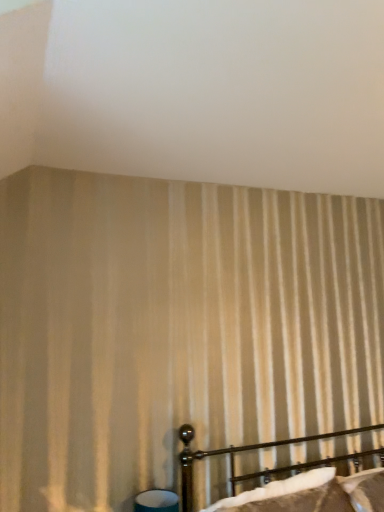
Question: Should I look upward or downward to see polished dark brown bed at lower right?

Choices:
 (A) down
 (B) up

Answer: (A)

Question: From the image's perspective, is teal fabric table lamp at lower center on polished dark brown bed at lower right?

Choices:
 (A) no
 (B) yes

Answer: (A)

Question: Is teal fabric table lamp at lower center located outside polished dark brown bed at lower right?

Choices:
 (A) yes
 (B) no

Answer: (A)

Question: Is teal fabric table lamp at lower center directly adjacent to polished dark brown bed at lower right?

Choices:
 (A) yes
 (B) no

Answer: (B)

Question: Is teal fabric table lamp at lower center bigger than polished dark brown bed at lower right?

Choices:
 (A) no
 (B) yes

Answer: (A)

Question: Is the depth of teal fabric table lamp at lower center greater than that of polished dark brown bed at lower right?

Choices:
 (A) yes
 (B) no

Answer: (A)

Question: From the image's perspective, is teal fabric table lamp at lower center located beneath polished dark brown bed at lower right?

Choices:
 (A) no
 (B) yes

Answer: (B)

Question: Would you say teal fabric table lamp at lower center is part of polished dark brown bed at lower right's contents?

Choices:
 (A) no
 (B) yes

Answer: (A)

Question: From a real-world perspective, is polished dark brown bed at lower right over teal fabric table lamp at lower center?

Choices:
 (A) yes
 (B) no

Answer: (A)

Question: Is polished dark brown bed at lower right turned away from teal fabric table lamp at lower center?

Choices:
 (A) yes
 (B) no

Answer: (B)

Question: Is polished dark brown bed at lower right next to teal fabric table lamp at lower center and touching it?

Choices:
 (A) no
 (B) yes

Answer: (A)

Question: From the image's perspective, does polished dark brown bed at lower right appear higher than teal fabric table lamp at lower center?

Choices:
 (A) no
 (B) yes

Answer: (B)

Question: Is polished dark brown bed at lower right to the right of teal fabric table lamp at lower center from the viewer's perspective?

Choices:
 (A) yes
 (B) no

Answer: (A)

Question: In terms of width, does polished dark brown bed at lower right look wider or thinner when compared to teal fabric table lamp at lower center?

Choices:
 (A) thin
 (B) wide

Answer: (B)